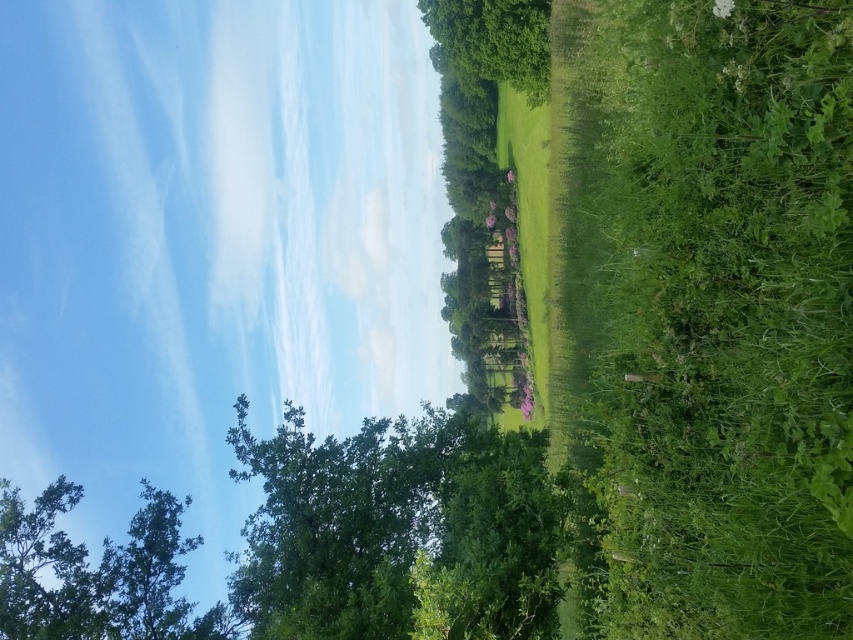
Question: Does green leafy tree at right have a smaller size compared to green leafy tree at lower left?

Choices:
 (A) no
 (B) yes

Answer: (A)

Question: Where is green leafy tree at lower left located in relation to green leafy tree at upper center in the image?

Choices:
 (A) below
 (B) above

Answer: (A)

Question: Which point is farther to the camera?

Choices:
 (A) (421, 8)
 (B) (408, 444)
 (C) (9, 628)
 (D) (636, 8)

Answer: (A)

Question: Can you confirm if green leafy tree at right is positioned to the right of green leafy tree at upper center?

Choices:
 (A) no
 (B) yes

Answer: (B)

Question: Among these objects, which one is farthest from the camera?

Choices:
 (A) green leafy tree at upper center
 (B) green leafy tree at center
 (C) green leafy tree at right

Answer: (A)

Question: Estimate the real-world distances between objects in this image. Which object is closer to the green leafy tree at center?

Choices:
 (A) green leafy tree at right
 (B) green leafy tree at lower left
 (C) green leafy tree at upper center

Answer: (A)